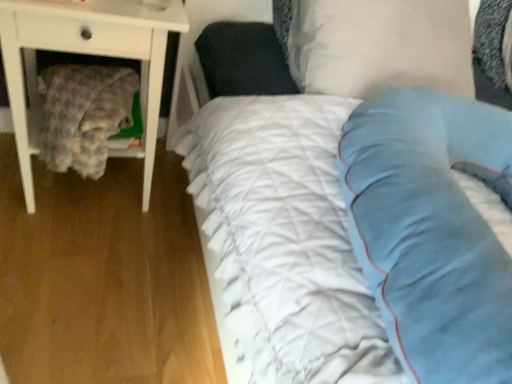
This screenshot has width=512, height=384. I want to click on white quilted fabric at center, so click(x=424, y=223).

At what (x,y) coordinates should I click in order to perform the action: click on white wood nightstand at left. Please return your answer as a coordinate pair (x, y). Looking at the image, I should click on (86, 53).

Is fluffy fabric blanket at left beside white quilted fabric at center?

No, fluffy fabric blanket at left is not touching white quilted fabric at center.

From the image's perspective, relative to white quilted fabric at center, is fluffy fabric blanket at left above or below?

Clearly, from the image's perspective, fluffy fabric blanket at left is above white quilted fabric at center.

Is fluffy fabric blanket at left oriented towards white quilted fabric at center?

No, fluffy fabric blanket at left is not turned towards white quilted fabric at center.

Between point (112, 123) and point (212, 220), which one is positioned behind?

Positioned behind is point (112, 123).

From a real-world perspective, is white quilted fabric at center positioned over fluffy fabric blanket at left based on gravity?

Yes.

Which is in front, point (409, 328) or point (116, 124)?

The point (409, 328) is more forward.

From the image's perspective, between white quilted fabric at center and fluffy fabric blanket at left, which one is located above?

fluffy fabric blanket at left.

Who is taller, white wood nightstand at left or white quilted fabric at center?

white wood nightstand at left.

Looking at the image, does white wood nightstand at left seem bigger or smaller compared to white quilted fabric at center?

In the image, white wood nightstand at left appears to be larger than white quilted fabric at center.

Could white quilted fabric at center be considered to be inside white wood nightstand at left?

No.

Is white soft pillow at upper center looking in the opposite direction of fluffy fabric blanket at left?

white soft pillow at upper center does not have its back to fluffy fabric blanket at left.

From a real-world perspective, is white soft pillow at upper center on fluffy fabric blanket at left?

Yes, from a real-world perspective, white soft pillow at upper center is on top of fluffy fabric blanket at left.

Is white soft pillow at upper center beside fluffy fabric blanket at left?

There is a gap between white soft pillow at upper center and fluffy fabric blanket at left.

Is point (372, 25) positioned behind point (119, 126)?

No, (372, 25) is closer to viewer.

From the image's perspective, who appears lower, fluffy fabric blanket at left or white wood nightstand at left?

fluffy fabric blanket at left is shown below in the image.

In terms of height, does fluffy fabric blanket at left look taller or shorter compared to white wood nightstand at left?

Considering their sizes, fluffy fabric blanket at left has less height than white wood nightstand at left.

Is fluffy fabric blanket at left in contact with white wood nightstand at left?

No, fluffy fabric blanket at left is not beside white wood nightstand at left.

Identify the location of material located on the right of white wood nightstand at left. (84, 115).

Does point (347, 22) lie in front of point (397, 375)?

No.

Which of these two, white soft pillow at upper center or white quilted fabric at center, is thinner?

white soft pillow at upper center.

Is white soft pillow at upper center facing away from white quilted fabric at center?

white soft pillow at upper center is not turned away from white quilted fabric at center.

How distant is white soft pillow at upper center from white quilted fabric at center?

white soft pillow at upper center is 11.99 inches away from white quilted fabric at center.

Is white quilted fabric at center not inside white wood nightstand at left?

Indeed, white quilted fabric at center is completely outside white wood nightstand at left.

From the image's perspective, is white quilted fabric at center above or below white wood nightstand at left?

Clearly, from the image's perspective, white quilted fabric at center is below white wood nightstand at left.

Does point (394, 293) come in front of point (65, 43)?

Yes.

Find the location of `bed above the fluffy fabric blanket at left (from a real-world perspective)`. bed above the fluffy fabric blanket at left (from a real-world perspective) is located at coordinates (424, 223).

In the image, there is a fluffy fabric blanket at left. At what (x,y) coordinates should I click in order to perform the action: click on bed below it (from the image's perspective). Please return your answer as a coordinate pair (x, y). Looking at the image, I should click on (424, 223).

Consider the image. Considering their positions, is white quilted fabric at center positioned closer to fluffy fabric blanket at left than white soft pillow at upper center?

The object closer to fluffy fabric blanket at left is white quilted fabric at center.

Which object lies further to the anchor point fluffy fabric blanket at left, white wood nightstand at left or white quilted fabric at center?

Based on the image, white quilted fabric at center appears to be further to fluffy fabric blanket at left.

Consider the image. Considering their positions, is white wood nightstand at left positioned closer to white quilted fabric at center than white soft pillow at upper center?

white soft pillow at upper center lies closer to white quilted fabric at center than the other object.

Considering their positions, is white quilted fabric at center positioned further to fluffy fabric blanket at left than white wood nightstand at left?

The object further to fluffy fabric blanket at left is white quilted fabric at center.

Considering their positions, is white wood nightstand at left positioned closer to white quilted fabric at center than fluffy fabric blanket at left?

The object closer to white quilted fabric at center is white wood nightstand at left.

From the picture: Looking at the image, which one is located further to white soft pillow at upper center, fluffy fabric blanket at left or white quilted fabric at center?

fluffy fabric blanket at left is further to white soft pillow at upper center.

When comparing their distances from white quilted fabric at center, does fluffy fabric blanket at left or white wood nightstand at left seem closer?

white wood nightstand at left is closer to white quilted fabric at center.

Estimate the real-world distances between objects in this image. Which object is closer to white quilted fabric at center, white soft pillow at upper center or fluffy fabric blanket at left?

The object closer to white quilted fabric at center is white soft pillow at upper center.

This screenshot has width=512, height=384. In order to click on pillow between fluffy fabric blanket at left and white quilted fabric at center from left to right in this screenshot , I will do `click(380, 46)`.

This screenshot has height=384, width=512. I want to click on material between white wood nightstand at left and white quilted fabric at center in the horizontal direction, so click(84, 115).

You are a GUI agent. You are given a task and a screenshot of the screen. Output one action in this format:
    pyautogui.click(x=<x>, y=<y>)
    Task: Click on the pillow between white wood nightstand at left and white quilted fabric at center from left to right
    This screenshot has width=512, height=384.
    Given the screenshot: What is the action you would take?
    pyautogui.click(x=380, y=46)

At what (x,y) coordinates should I click in order to perform the action: click on material between white wood nightstand at left and white soft pillow at upper center in the horizontal direction. Please return your answer as a coordinate pair (x, y). The width and height of the screenshot is (512, 384). Looking at the image, I should click on (84, 115).